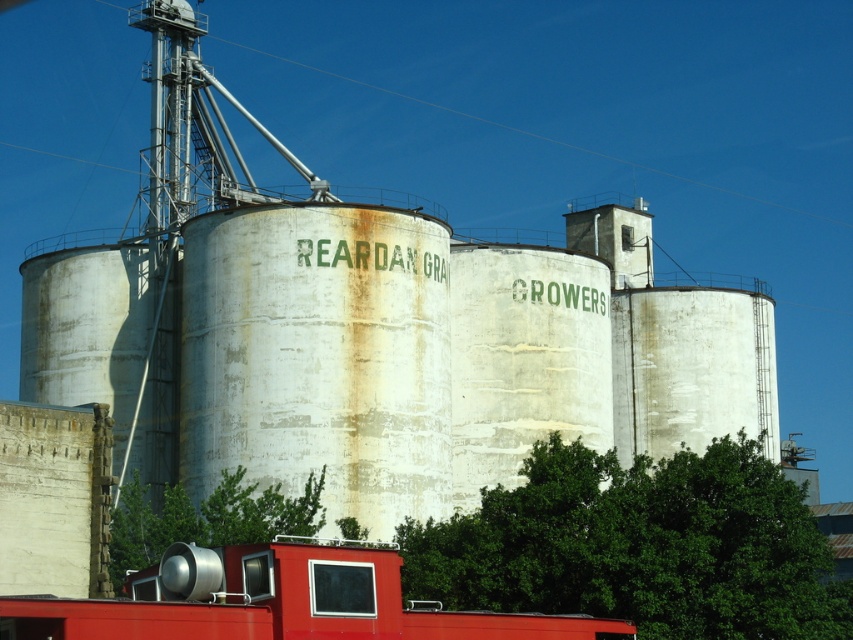
Question: Is metallic trailer truck at lower center to the right of green leafy tree at lower center from the viewer's perspective?

Choices:
 (A) no
 (B) yes

Answer: (B)

Question: From the image, what is the correct spatial relationship of metallic trailer truck at lower center in relation to green leafy tree at lower center?

Choices:
 (A) above
 (B) below

Answer: (B)

Question: Which object is positioned closest to the green leafy tree at center?

Choices:
 (A) metallic trailer truck at lower center
 (B) green leafy tree at lower center

Answer: (B)

Question: Does metallic trailer truck at lower center come in front of green leafy tree at lower center?

Choices:
 (A) yes
 (B) no

Answer: (A)

Question: Which is farther from the metallic trailer truck at lower center?

Choices:
 (A) green leafy tree at center
 (B) green leafy tree at lower center

Answer: (A)

Question: Which point is farther to the camera?

Choices:
 (A) green leafy tree at center
 (B) metallic trailer truck at lower center

Answer: (A)